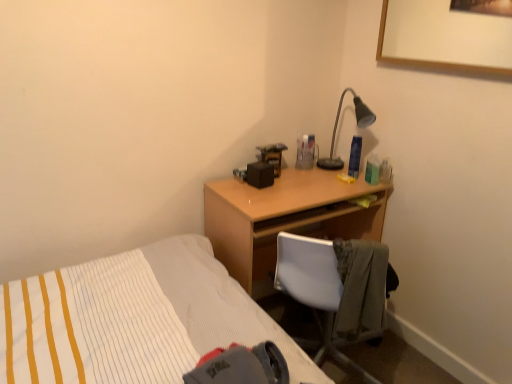
Question: Does light brown wood desk at center have a greater width compared to white plastic chair at center?

Choices:
 (A) yes
 (B) no

Answer: (B)

Question: Can you see light brown wood desk at center touching white plastic chair at center?

Choices:
 (A) yes
 (B) no

Answer: (B)

Question: Is there a large distance between light brown wood desk at center and white plastic chair at center?

Choices:
 (A) yes
 (B) no

Answer: (B)

Question: Can you confirm if light brown wood desk at center is thinner than white plastic chair at center?

Choices:
 (A) no
 (B) yes

Answer: (B)

Question: From a real-world perspective, is light brown wood desk at center on top of white plastic chair at center?

Choices:
 (A) no
 (B) yes

Answer: (B)

Question: Considering the positions of point (369, 119) and point (276, 263), is point (369, 119) closer or farther from the camera than point (276, 263)?

Choices:
 (A) closer
 (B) farther

Answer: (A)

Question: From the image's perspective, relative to white plastic chair at center, is matte black desk lamp at upper right above or below?

Choices:
 (A) below
 (B) above

Answer: (B)

Question: Considering the relative positions of matte black desk lamp at upper right and white plastic chair at center in the image provided, is matte black desk lamp at upper right to the left or to the right of white plastic chair at center?

Choices:
 (A) right
 (B) left

Answer: (A)

Question: Looking at the image, does matte black desk lamp at upper right seem bigger or smaller compared to white plastic chair at center?

Choices:
 (A) small
 (B) big

Answer: (A)

Question: From the image's perspective, relative to light brown wood desk at center, is white plastic chair at center above or below?

Choices:
 (A) below
 (B) above

Answer: (A)

Question: Is point (328, 244) closer or farther from the camera than point (321, 205)?

Choices:
 (A) closer
 (B) farther

Answer: (A)

Question: Looking at their shapes, would you say white plastic chair at center is wider or thinner than light brown wood desk at center?

Choices:
 (A) thin
 (B) wide

Answer: (B)

Question: In the image, is white plastic chair at center positioned in front of or behind light brown wood desk at center?

Choices:
 (A) front
 (B) behind

Answer: (A)

Question: From the image's perspective, is light brown wood desk at center located above or below white plastic chair at center?

Choices:
 (A) below
 (B) above

Answer: (B)

Question: Visually, is light brown wood desk at center positioned to the left or to the right of white plastic chair at center?

Choices:
 (A) left
 (B) right

Answer: (A)